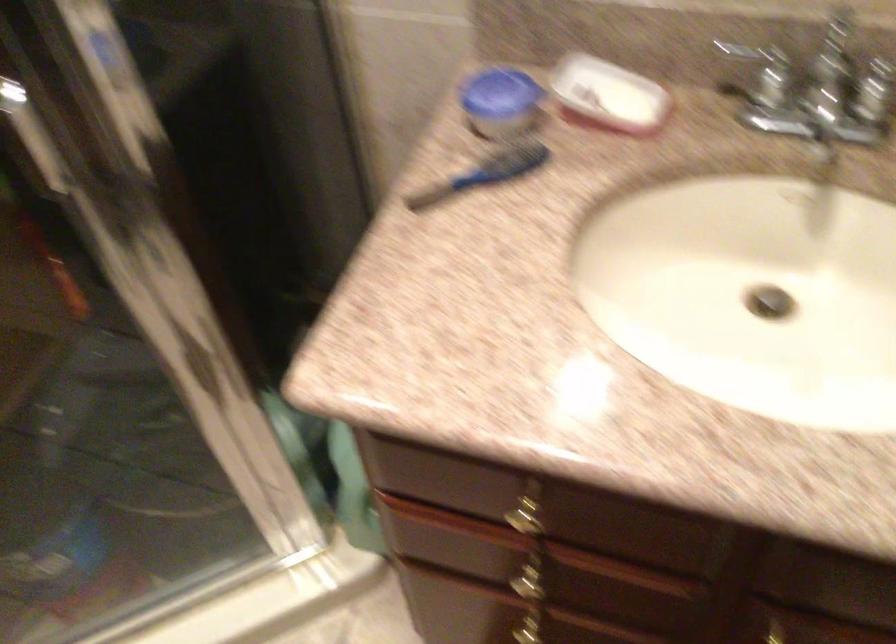
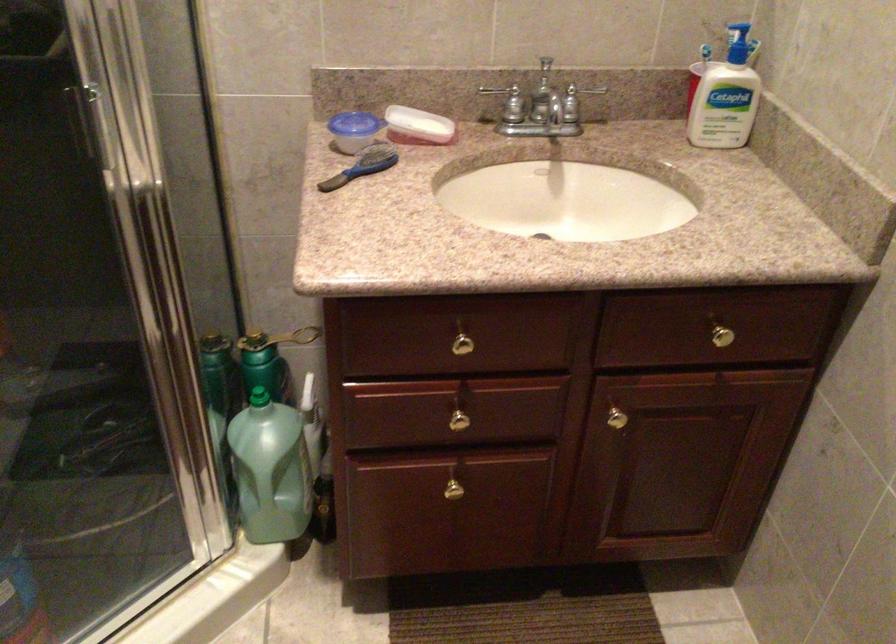
Locate, in the second image, the point that corresponds to point 488,174 in the first image.

(364, 166)